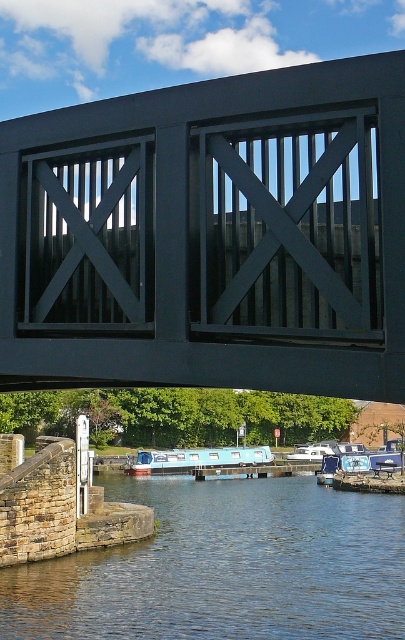
Who is more forward, (x=223, y=285) or (x=213, y=467)?

Point (x=223, y=285) is in front.

Is matte black gate at center to the left of light blue plastic boat at center from the viewer's perspective?

Yes, matte black gate at center is to the left of light blue plastic boat at center.

Is point (243, 262) behind point (149, 474)?

No, (243, 262) is closer to viewer.

Where is `matte black gate at center`? This screenshot has width=405, height=640. matte black gate at center is located at coordinates (211, 236).

Looking at this image, can you confirm if smooth concrete river at lower center is positioned above light blue plastic boat at center?

Indeed, smooth concrete river at lower center is positioned over light blue plastic boat at center.

Is smooth concrete river at lower center bigger than light blue plastic boat at center?

Correct, smooth concrete river at lower center is larger in size than light blue plastic boat at center.

This screenshot has height=640, width=405. Identify the location of smooth concrete river at lower center. (225, 566).

Find the location of `smooth concrete river at lower center`. smooth concrete river at lower center is located at coordinates (225, 566).

From the picture: Does matte black gate at center appear on the left side of smooth concrete river at lower center?

Yes, matte black gate at center is to the left of smooth concrete river at lower center.

Is matte black gate at center shorter than smooth concrete river at lower center?

Yes.

Locate an element on the screen. matte black gate at center is located at coordinates (211, 236).